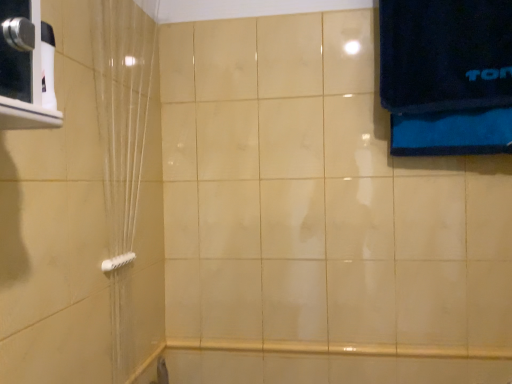
Question: In the image, is translucent plastic shower curtain at left on the left side or the right side of white plastic towel bar at lower left?

Choices:
 (A) right
 (B) left

Answer: (A)

Question: From a real-world perspective, is translucent plastic shower curtain at left positioned above or below white plastic towel bar at lower left?

Choices:
 (A) above
 (B) below

Answer: (A)

Question: In terms of size, does translucent plastic shower curtain at left appear bigger or smaller than white plastic towel bar at lower left?

Choices:
 (A) small
 (B) big

Answer: (B)

Question: Is white plastic towel bar at lower left in front of or behind translucent plastic shower curtain at left in the image?

Choices:
 (A) front
 (B) behind

Answer: (B)

Question: Would you say white plastic towel bar at lower left is inside or outside translucent plastic shower curtain at left?

Choices:
 (A) outside
 (B) inside

Answer: (B)

Question: In terms of width, does white plastic towel bar at lower left look wider or thinner when compared to translucent plastic shower curtain at left?

Choices:
 (A) wide
 (B) thin

Answer: (B)

Question: From the image's perspective, is white plastic towel bar at lower left positioned above or below translucent plastic shower curtain at left?

Choices:
 (A) above
 (B) below

Answer: (B)